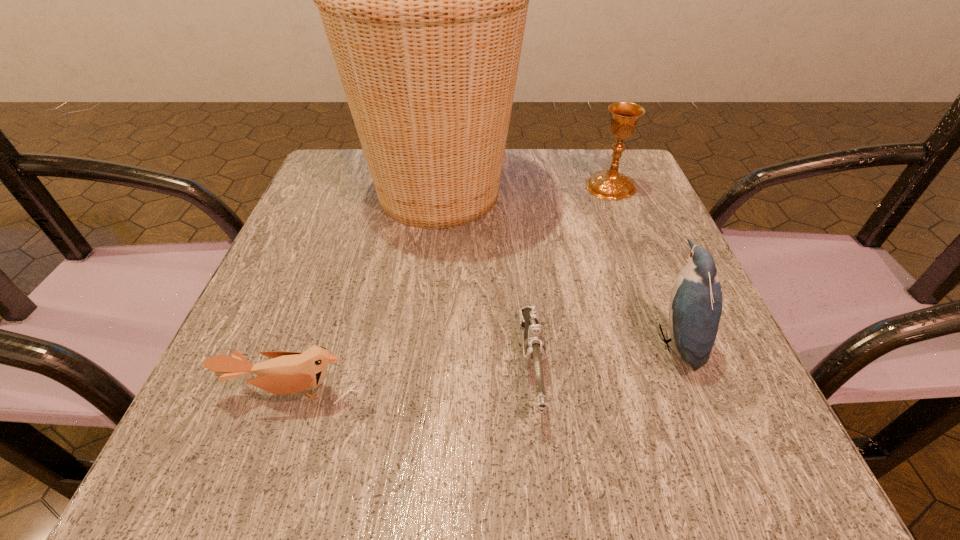
Identify the location of vacant area at the far edge. (524, 199).

In the image, there is a desktop. Where is `free space at the left edge`? The width and height of the screenshot is (960, 540). free space at the left edge is located at coordinates [x=292, y=223].

This screenshot has width=960, height=540. Find the location of `free space at the right edge of the desktop`. free space at the right edge of the desktop is located at coordinates (684, 381).

In the image, there is a desktop. Where is `vacant space at the far left corner`? The image size is (960, 540). vacant space at the far left corner is located at coordinates (338, 154).

You are a GUI agent. You are given a task and a screenshot of the screen. Output one action in this format:
    pyautogui.click(x=<x>, y=<y>)
    Task: Click on the vacant space at the far right corner of the desktop
    
    Given the screenshot: What is the action you would take?
    pyautogui.click(x=657, y=204)

Identify the location of empty space between the chalice and the left bird. (451, 289).

At what (x,y) coordinates should I click in order to perform the action: click on empty space that is in between the taller bird and the chalice. Please return your answer as a coordinate pair (x, y). Looking at the image, I should click on (642, 264).

Where is `free space between the shortest object and the tallest object`? The height and width of the screenshot is (540, 960). free space between the shortest object and the tallest object is located at coordinates (486, 280).

The width and height of the screenshot is (960, 540). In order to click on free point between the shorter bird and the chalice in this screenshot , I will do `click(451, 289)`.

At what (x,y) coordinates should I click in order to perform the action: click on empty space between the chalice and the left bird. Please return your answer as a coordinate pair (x, y). The height and width of the screenshot is (540, 960). Looking at the image, I should click on (451, 289).